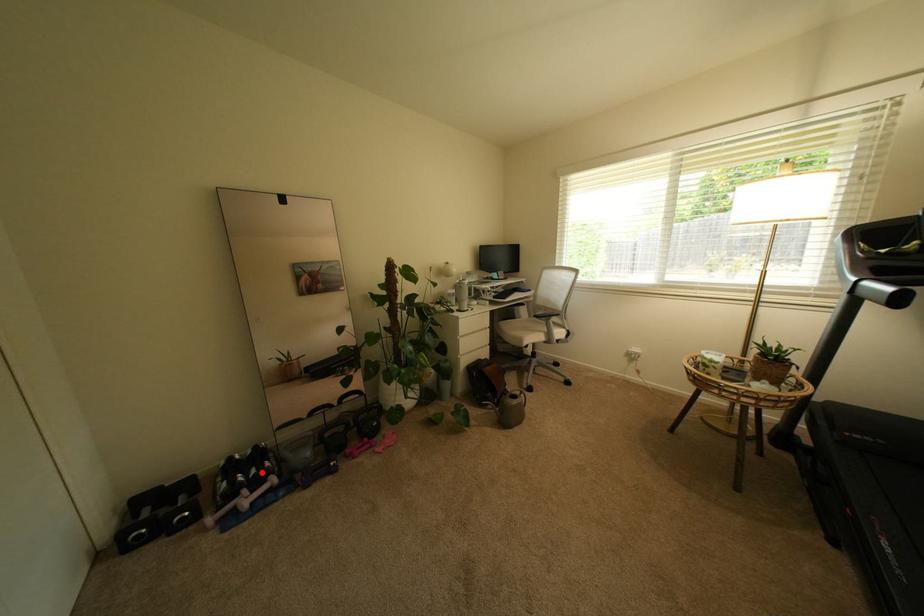
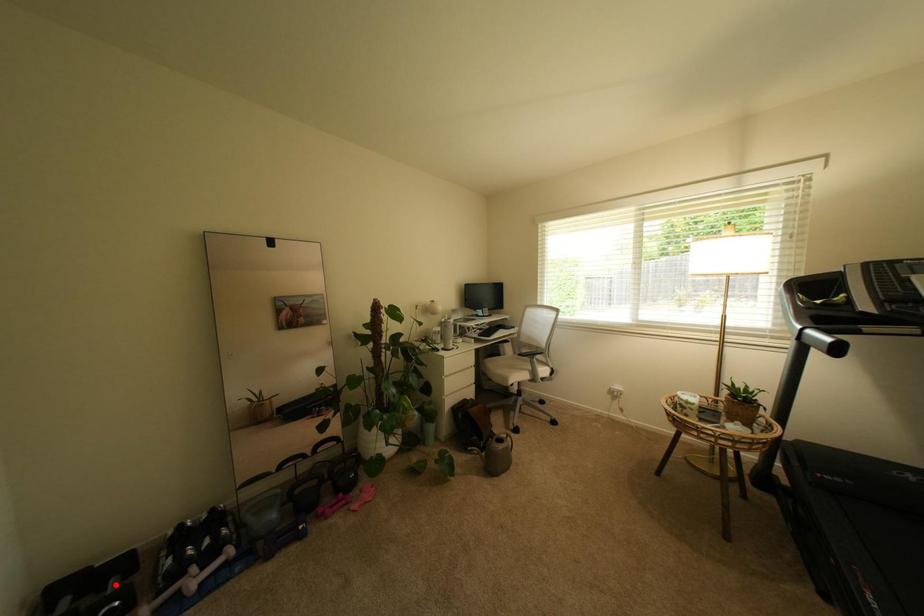
I am providing you with two images of the same scene from different viewpoints. A red point is marked on the first image and another point is marked on the second image. Do the highlighted points in image1 and image2 indicate the same real-world spot?

No